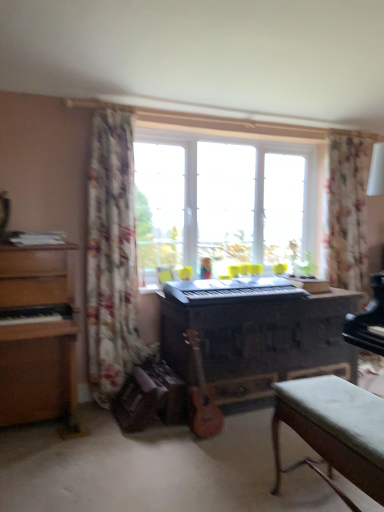
Question: Can you confirm if black plastic keyboard at center is positioned to the right of transparent glass window at center?

Choices:
 (A) no
 (B) yes

Answer: (A)

Question: Is black plastic keyboard at center next to transparent glass window at center?

Choices:
 (A) yes
 (B) no

Answer: (B)

Question: Is black plastic keyboard at center facing away from transparent glass window at center?

Choices:
 (A) yes
 (B) no

Answer: (A)

Question: Is black plastic keyboard at center far from transparent glass window at center?

Choices:
 (A) no
 (B) yes

Answer: (A)

Question: Is black plastic keyboard at center surrounding transparent glass window at center?

Choices:
 (A) yes
 (B) no

Answer: (B)

Question: From a real-world perspective, is wooden piano at center positioned above or below wooden acoustic guitar at center?

Choices:
 (A) above
 (B) below

Answer: (A)

Question: In terms of size, does wooden piano at center appear bigger or smaller than wooden acoustic guitar at center?

Choices:
 (A) small
 (B) big

Answer: (B)

Question: From their relative heights in the image, would you say wooden piano at center is taller or shorter than wooden acoustic guitar at center?

Choices:
 (A) tall
 (B) short

Answer: (A)

Question: In the image, is wooden piano at center positioned in front of or behind wooden acoustic guitar at center?

Choices:
 (A) behind
 (B) front

Answer: (A)

Question: In the image, is floral fabric curtain at upper right, acting as the first curtain starting from the right, positioned in front of or behind wooden piano at center?

Choices:
 (A) front
 (B) behind

Answer: (B)

Question: Looking at their shapes, would you say floral fabric curtain at upper right, marked as the 2th curtain in a front-to-back arrangement, is wider or thinner than wooden piano at center?

Choices:
 (A) thin
 (B) wide

Answer: (A)

Question: From the image's perspective, is floral fabric curtain at upper right, which appears as the second curtain when viewed from the left, above or below wooden piano at center?

Choices:
 (A) below
 (B) above

Answer: (B)

Question: Is floral fabric curtain at upper right, acting as the first curtain starting from the right, to the left or to the right of wooden piano at center in the image?

Choices:
 (A) left
 (B) right

Answer: (B)

Question: Would you say wooden acoustic guitar at center is to the left or to the right of wooden piano at center in the picture?

Choices:
 (A) left
 (B) right

Answer: (A)

Question: Is wooden acoustic guitar at center taller or shorter than wooden piano at center?

Choices:
 (A) short
 (B) tall

Answer: (A)